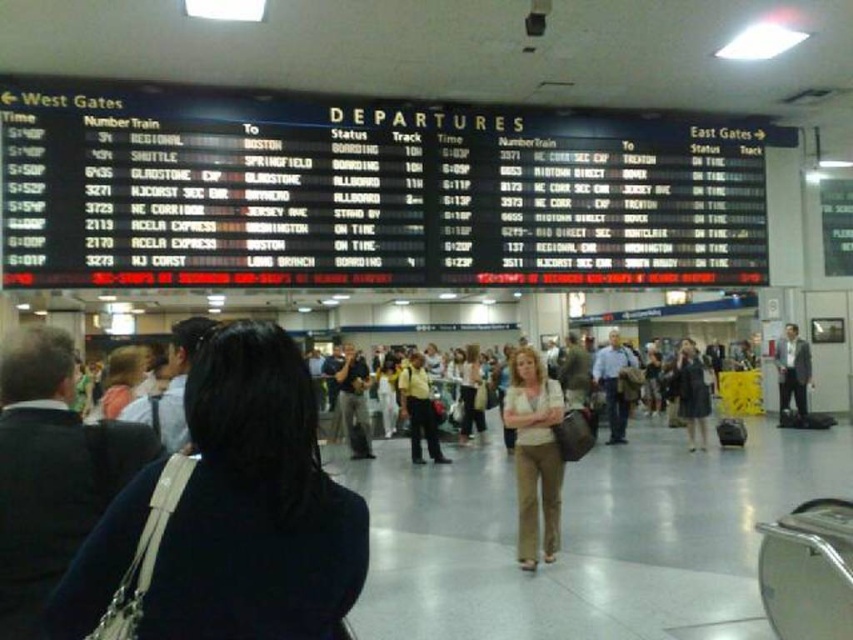
You are standing at the train station departures board area. You see a person wearing beige fabric pants at center and another wearing dark gray shirt at center. Which person is closer to you?

The beige fabric pants at center is in front of the dark gray shirt at center, so the person wearing the beige fabric pants at center is closer to you.